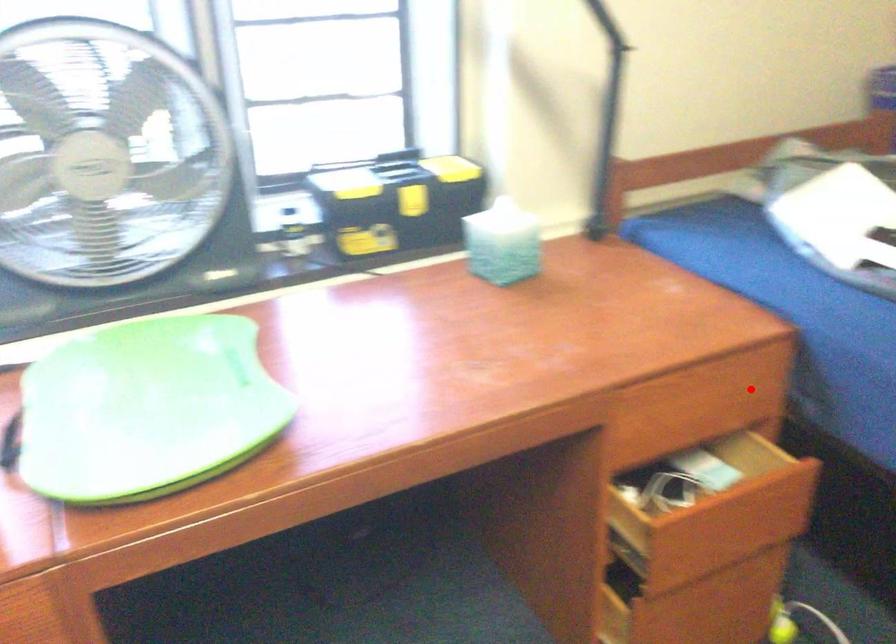
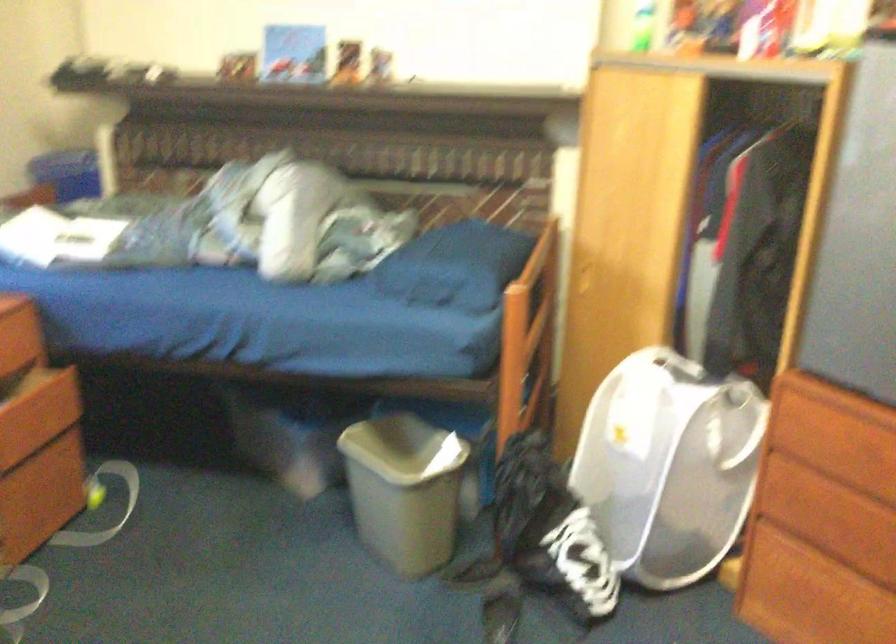
Question: I am providing you with two images of the same scene from different viewpoints. In image1, a red point is highlighted. Considering the same 3D point in image2, which of the following is correct?

Choices:
 (A) It is closer
 (B) It is farther

Answer: (B)